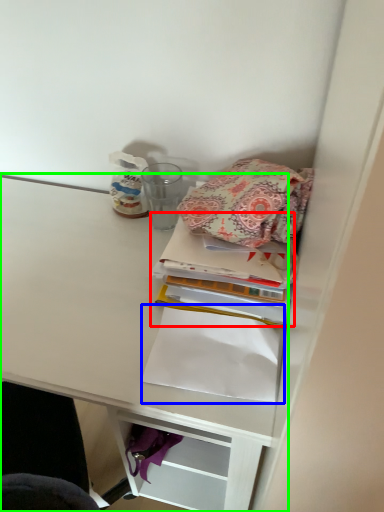
Question: Which object is positioned closest to book (highlighted by a red box)? Select from notebook (highlighted by a blue box) and shelf (highlighted by a green box).

Choices:
 (A) notebook
 (B) shelf

Answer: (A)